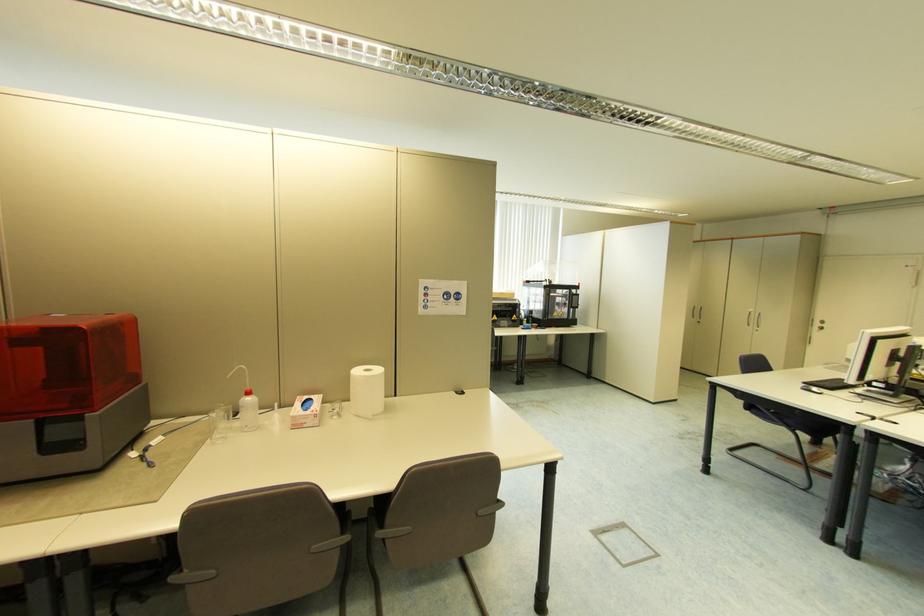
Locate an element on the screen. red printer cover is located at coordinates (66, 363).